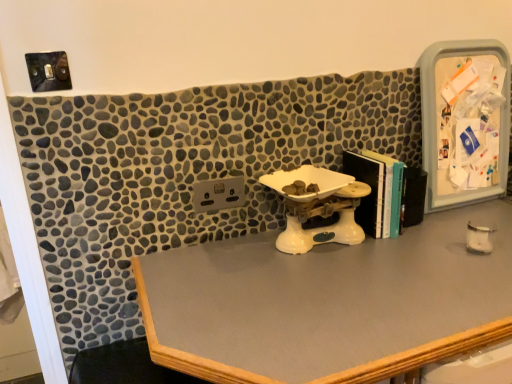
At what (x,y) coordinates should I click in order to perform the action: click on vacant area that lies in front of hardcover books at center-right. Please return your answer as a coordinate pair (x, y). The image size is (512, 384). Looking at the image, I should click on (405, 253).